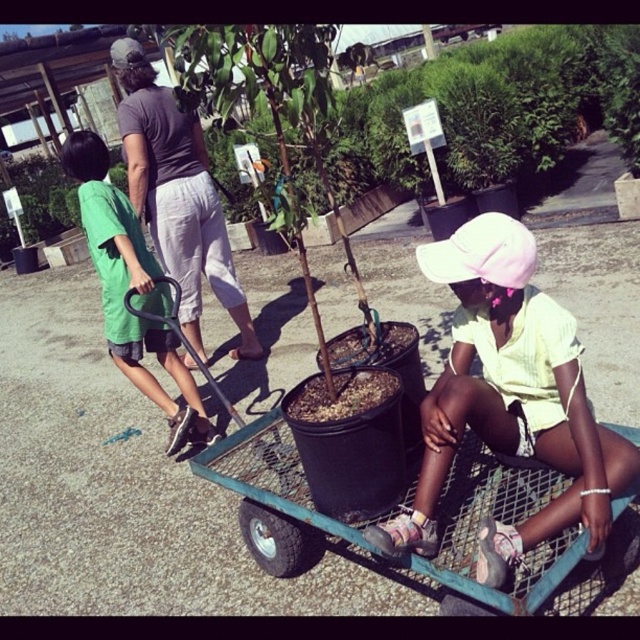
Question: Which point appears farthest from the camera in this image?

Choices:
 (A) (x=67, y=141)
 (B) (x=460, y=385)
 (C) (x=291, y=488)
 (D) (x=188, y=164)

Answer: (D)

Question: Estimate the real-world distances between objects in this image. Which object is farther from the green metal cart at center?

Choices:
 (A) white matte hat at center
 (B) green cotton shirt at left
 (C) gray cotton shirt at upper left

Answer: (C)

Question: Which point is farther from the camera taking this photo?

Choices:
 (A) (564, 545)
 (B) (582, 477)
 (C) (129, 65)

Answer: (C)

Question: Does green metal cart at center have a greater width compared to gray cotton shirt at upper left?

Choices:
 (A) no
 (B) yes

Answer: (B)

Question: Where is white matte hat at center located in relation to green metal cart at center in the image?

Choices:
 (A) above
 (B) below

Answer: (A)

Question: Is green metal cart at center above gray cotton shirt at upper left?

Choices:
 (A) yes
 (B) no

Answer: (B)